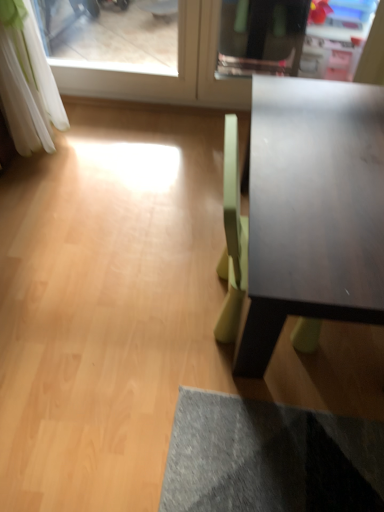
Locate an element on the screen. free location above metallic smooth table at right (from a real-world perspective) is located at coordinates (331, 156).